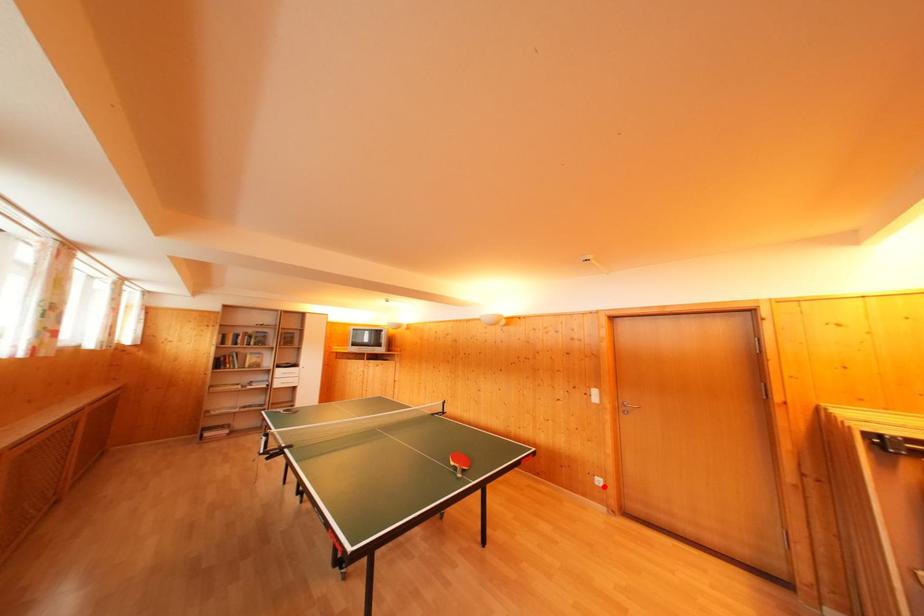
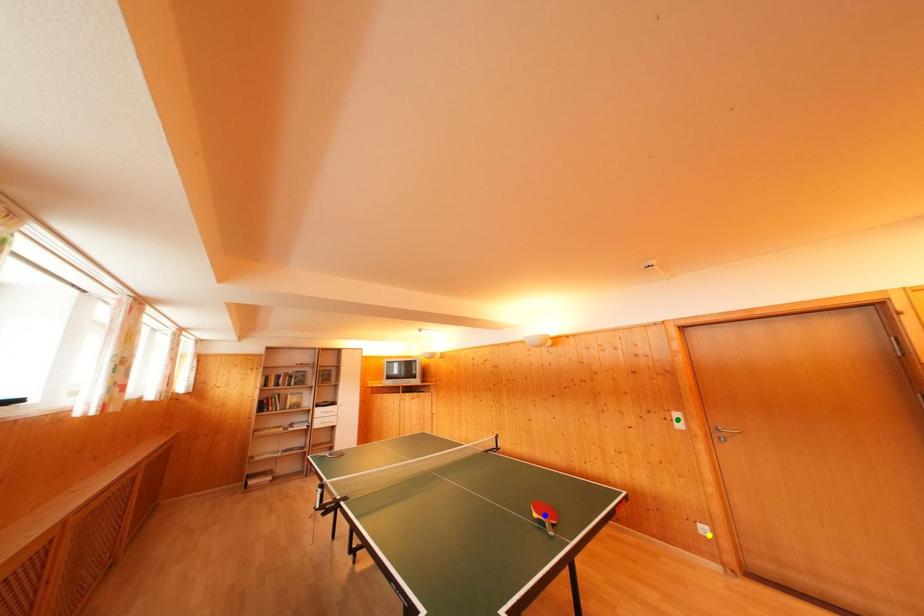
Question: I am providing you with two images of the same scene from different viewpoints. A red point is marked on the first image. You are given multiple points on the second image. Which point in image 2 is actually the same real-world point as the red point in image 1?

Choices:
 (A) green point
 (B) blue point
 (C) yellow point

Answer: (C)